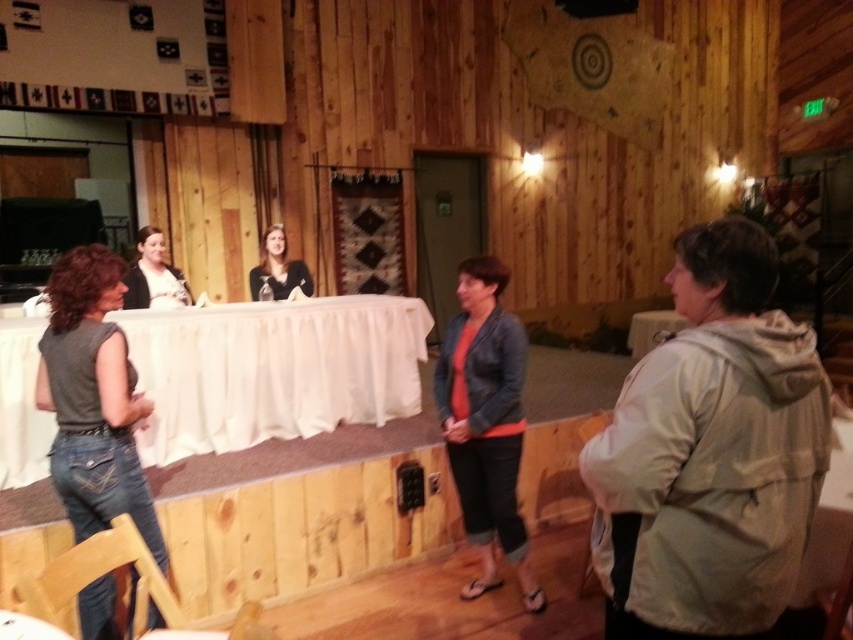
You are standing at the entrance of the community hall and see two points marked in the image. The first point is at coordinate point (107, 573) and the second is at point (279, 294). If you were to walk towards both points from your current position, which point would you reach first?

Point (107, 573) is in front of point (279, 294), so you would reach point (107, 573) first.

You are standing at the entrance of the community hall and want to place a centerpiece on the white satin tablecloth at center. Based on its position, can you determine if the tablecloth is centrally located in the room?

The white satin tablecloth at center is located at point coordinates (271, 369), which suggests it is positioned near the center of the room, making it an ideal spot for placing a centerpiece.